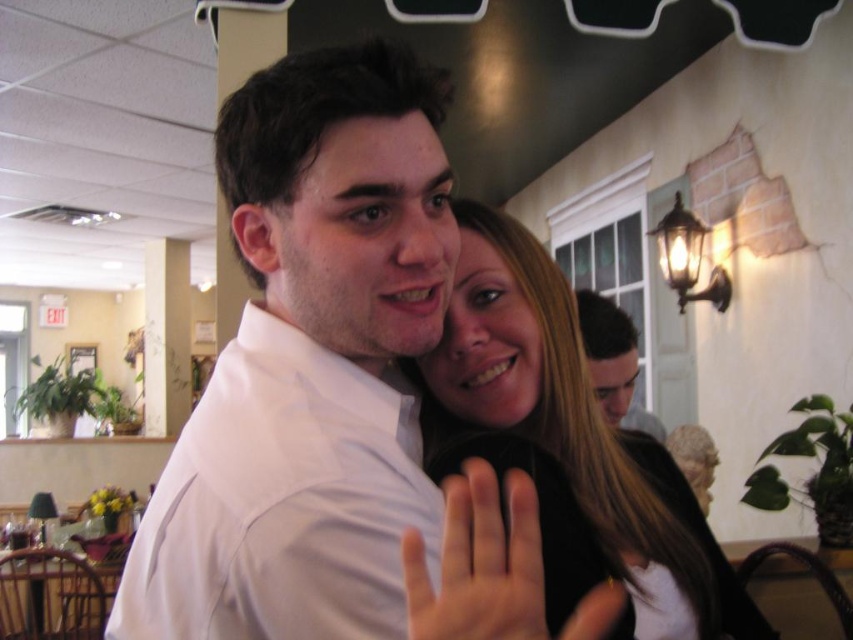
Which is more to the left, smooth skin hand at center or matte white shirt at upper center?

From the viewer's perspective, smooth skin hand at center appears more on the left side.

Between smooth skin hand at center and matte white shirt at upper center, which one is positioned higher?

matte white shirt at upper center

Between point (512, 524) and point (631, 344), which one is positioned in front?

Point (512, 524) is in front.

I want to click on smooth skin hand at center, so click(479, 561).

From the picture: Does white smooth shirt at center lie behind matte white shirt at upper center?

No, it is not.

Is white smooth shirt at center bigger than matte white shirt at upper center?

Indeed, white smooth shirt at center has a larger size compared to matte white shirt at upper center.

Locate an element on the screen. white smooth shirt at center is located at coordinates 329,388.

Identify the location of white smooth shirt at center. (329, 388).

Which of these two, white smooth shirt at center or smooth skin hand at center, stands taller?

white smooth shirt at center

Is point (291, 116) positioned in front of point (511, 582)?

No, it is behind (511, 582).

Find the location of `white smooth shirt at center`. white smooth shirt at center is located at coordinates (329, 388).